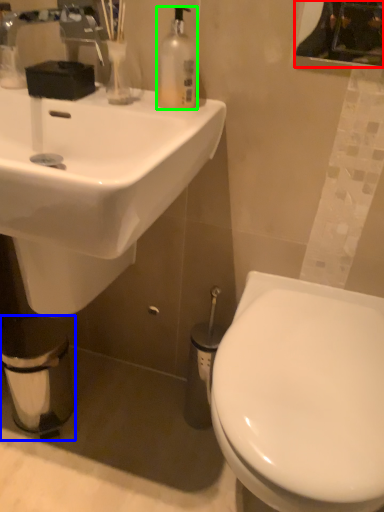
Question: Based on their relative distances, which object is nearer to mirror (highlighted by a red box)? Choose from toilet paper (highlighted by a blue box) and bottle (highlighted by a green box).

Choices:
 (A) toilet paper
 (B) bottle

Answer: (B)